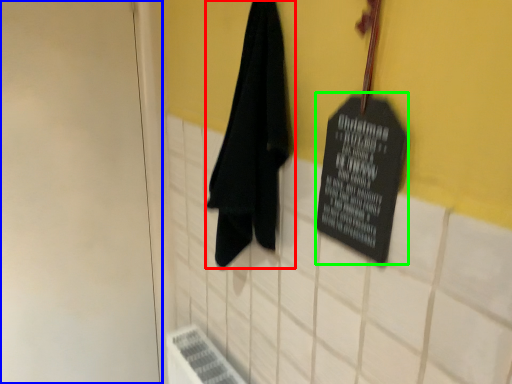
Question: Which object is positioned farthest from towel (highlighted by a red box)? Select from door (highlighted by a blue box) and bulletin board (highlighted by a green box).

Choices:
 (A) door
 (B) bulletin board

Answer: (A)